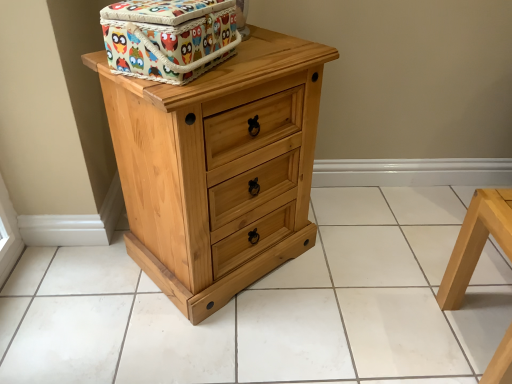
I want to click on free point below light wood stool at lower right (from a real-world perspective), so click(x=484, y=329).